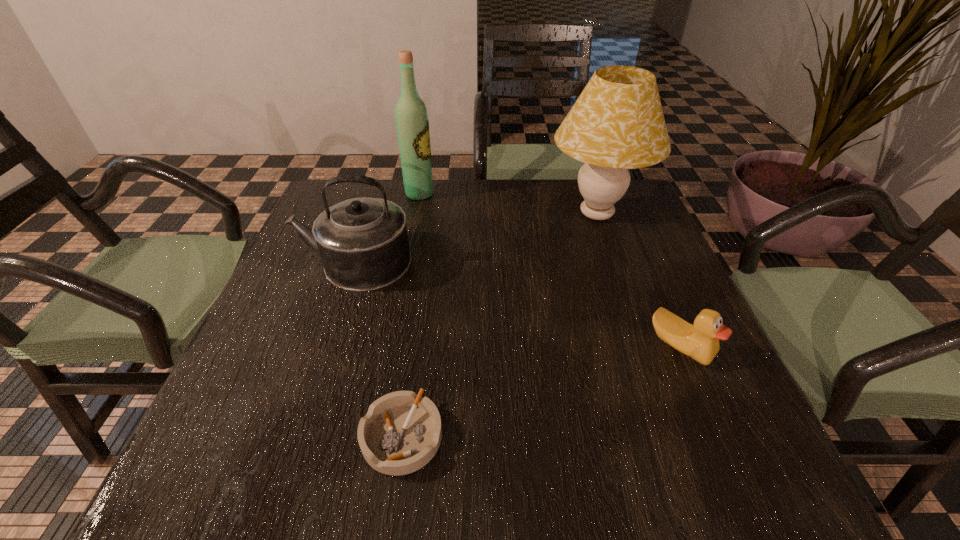
Where is `vacant area that lies between the wine bottle and the shortest object`? The height and width of the screenshot is (540, 960). vacant area that lies between the wine bottle and the shortest object is located at coordinates (411, 315).

You are a GUI agent. You are given a task and a screenshot of the screen. Output one action in this format:
    pyautogui.click(x=<x>, y=<y>)
    Task: Click on the free spot between the kettle and the second shortest object
    
    Given the screenshot: What is the action you would take?
    pyautogui.click(x=517, y=304)

Where is `vacant area that lies between the duck and the wine bottle`? Image resolution: width=960 pixels, height=540 pixels. vacant area that lies between the duck and the wine bottle is located at coordinates (550, 270).

Locate an element on the screen. free spot between the third tallest object and the ashtray is located at coordinates (378, 349).

At what (x,y) coordinates should I click in order to perform the action: click on object that is the third closest to the ashtray. Please return your answer as a coordinate pair (x, y). The height and width of the screenshot is (540, 960). Looking at the image, I should click on (617, 123).

This screenshot has width=960, height=540. I want to click on object that is the closest to the lampshade, so click(x=700, y=342).

This screenshot has width=960, height=540. Identify the location of vacant space that satisfies the following two spatial constraints: 1. on the back side of the ashtray; 2. with the spout at the front of the kettle. (426, 262).

The height and width of the screenshot is (540, 960). In order to click on vacant area that satisfies the following two spatial constraints: 1. on the front-facing side of the wine bottle; 2. on the back side of the shortest object in this screenshot , I will do [373, 436].

The image size is (960, 540). I want to click on free location that satisfies the following two spatial constraints: 1. with the spout at the front of the nearest object; 2. on the left side of the third tallest object, so click(298, 436).

At what (x,y) coordinates should I click in order to perform the action: click on vacant region that satisfies the following two spatial constraints: 1. on the front-facing side of the wine bottle; 2. on the right side of the ashtray. Please return your answer as a coordinate pair (x, y). Looking at the image, I should click on pos(373,436).